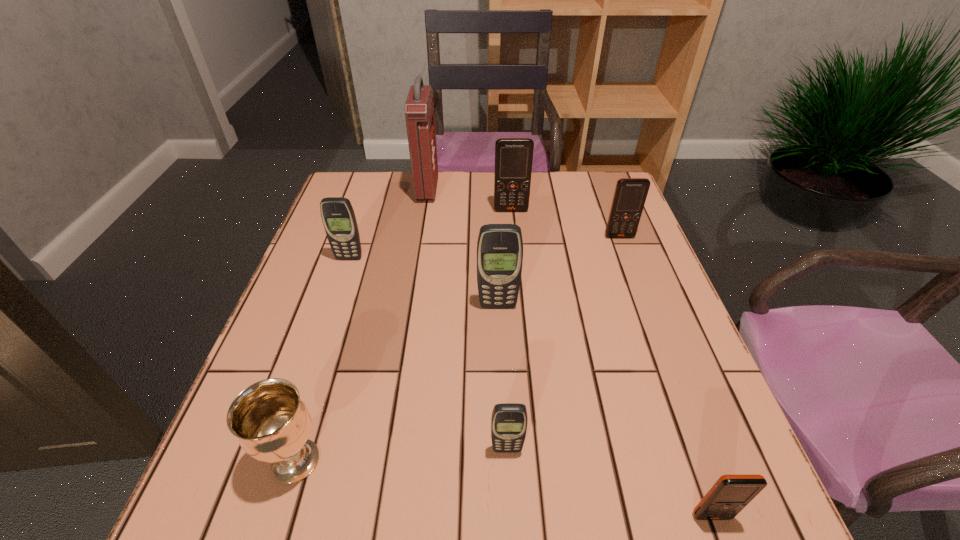
Where is `vacant space located on the back of the chalice`? vacant space located on the back of the chalice is located at coordinates (328, 355).

Image resolution: width=960 pixels, height=540 pixels. I want to click on vacant space located 0.050m on the screen of the smallest gray cellular telephone, so coord(509,483).

Locate an element on the screen. the first-aid kit located in the far edge section of the desktop is located at coordinates (419, 109).

At what (x,y) coordinates should I click in order to perform the action: click on cellular telephone that is at the far edge. Please return your answer as a coordinate pair (x, y). Looking at the image, I should click on (513, 156).

You are a GUI agent. You are given a task and a screenshot of the screen. Output one action in this format:
    pyautogui.click(x=<x>, y=<y>)
    Task: Click on the chalice located at the near edge
    The image size is (960, 540).
    Given the screenshot: What is the action you would take?
    pyautogui.click(x=272, y=423)

At what (x,y) coordinates should I click in order to perform the action: click on cellular telephone at the near edge. Please return your answer as a coordinate pair (x, y). Looking at the image, I should click on (730, 494).

Locate an element on the screen. This screenshot has width=960, height=540. cellular telephone present at the left edge is located at coordinates (338, 217).

The width and height of the screenshot is (960, 540). I want to click on chalice located at the left edge, so click(x=272, y=423).

Find the location of `object present at the near left corner`. object present at the near left corner is located at coordinates (272, 423).

You are a GUI agent. You are given a task and a screenshot of the screen. Output one action in this format:
    pyautogui.click(x=<x>, y=<y>)
    Task: Click on the object that is at the near right corner
    The image size is (960, 540).
    Given the screenshot: What is the action you would take?
    (x=730, y=494)